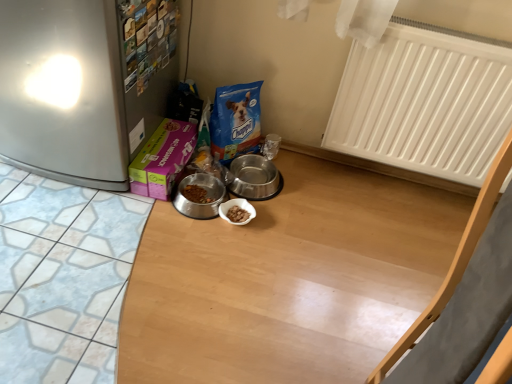
Question: Considering the positions of metallic stainless steel bowl at center, which appears as the first appliance when viewed from the right, and metallic silver bowl at center, the 1th appliance viewed from the left, in the image, is metallic stainless steel bowl at center, which appears as the first appliance when viewed from the right, bigger or smaller than metallic silver bowl at center, the 1th appliance viewed from the left,?

Choices:
 (A) small
 (B) big

Answer: (A)

Question: From their relative heights in the image, would you say metallic stainless steel bowl at center, positioned as the 2th appliance in left-to-right order, is taller or shorter than metallic silver bowl at center, the 1th appliance viewed from the left?

Choices:
 (A) tall
 (B) short

Answer: (A)

Question: Which object is the farthest from the metallic stainless steel bowl at center, positioned as the 2th appliance in left-to-right order?

Choices:
 (A) metallic silver bowl at center, the 1th appliance viewed from the left
 (B) brushed metal fridge at left
 (C) white matte radiator at upper right
 (D) matte purple box at center-left

Answer: (B)

Question: Estimate the real-world distances between objects in this image. Which object is farther from the metallic silver bowl at center, which is the 2th appliance from right to left?

Choices:
 (A) brushed metal fridge at left
 (B) matte purple box at center-left
 (C) metallic stainless steel bowl at center, which appears as the first appliance when viewed from the right
 (D) white matte radiator at upper right

Answer: (D)